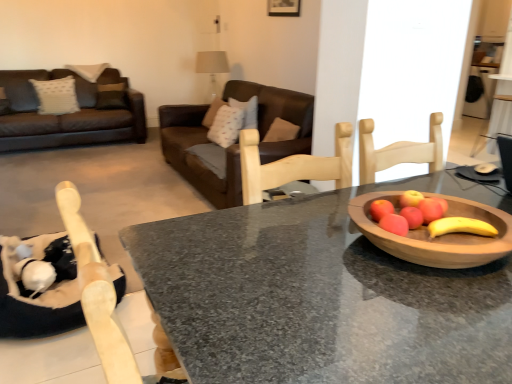
What is the approximate height of red matte apple at center?

The height of red matte apple at center is 4.58 centimeters.

I want to click on red matte apple at center, so click(412, 216).

Image resolution: width=512 pixels, height=384 pixels. Find the location of `red matte apple at center`. red matte apple at center is located at coordinates (412, 216).

Is granite table at center inside the boundaries of red matte apple at center, or outside?

The correct answer is: outside.

From the image's perspective, is granite table at center below red matte apple at center?

Yes, from the image's perspective, granite table at center is beneath red matte apple at center.

Can you confirm if granite table at center is positioned to the left of red matte apple at center?

In fact, granite table at center is to the right of red matte apple at center.

Where is `bowl below the red matte apple at center (from the image's perspective)`? The width and height of the screenshot is (512, 384). bowl below the red matte apple at center (from the image's perspective) is located at coordinates (440, 236).

Considering the sizes of objects red matte apple at center and wooden bowl at right in the image provided, who is taller, red matte apple at center or wooden bowl at right?

With more height is wooden bowl at right.

Which object is thinner, red matte apple at center or wooden bowl at right?

Thinner between the two is red matte apple at center.

Which is in front, point (412, 222) or point (396, 256)?

The point (396, 256) is closer.

Is red matte apple at center not within granite table at center?

Yes, red matte apple at center is outside of granite table at center.

Is red matte apple at center to the left or to the right of granite table at center in the image?

red matte apple at center is positioned on granite table at center's left side.

Considering the sizes of objects red matte apple at center and granite table at center in the image provided, who is thinner, red matte apple at center or granite table at center?

With smaller width is red matte apple at center.

Find the location of a particular element. This screenshot has height=384, width=512. desk located in front of the wooden bowl at right is located at coordinates (321, 296).

Relative to granite table at center, is wooden bowl at right in front or behind?

Visually, wooden bowl at right is located behind granite table at center.

Is wooden bowl at right smaller than granite table at center?

Correct, wooden bowl at right occupies less space than granite table at center.

Does wooden bowl at right appear on the left side of granite table at center?

Indeed, wooden bowl at right is positioned on the left side of granite table at center.

From the picture: Based on their sizes in the image, would you say granite table at center is bigger or smaller than wooden bowl at right?

Clearly, granite table at center is larger in size than wooden bowl at right.

Is wooden bowl at right a part of granite table at center?

No, wooden bowl at right is located outside of granite table at center.

Based on the photo, is granite table at center shorter than wooden bowl at right?

No.

In terms of width, does granite table at center look wider or thinner when compared to wooden bowl at right?

Considering their sizes, granite table at center looks broader than wooden bowl at right.

Based on their positions, is red matte apple at center located to the left or right of brown leather couch at center?

red matte apple at center is positioned on brown leather couch at center's right side.

Does red matte apple at center have a greater height compared to brown leather couch at center?

No, red matte apple at center is not taller than brown leather couch at center.

How many degrees apart are the facing directions of red matte apple at center and brown leather couch at center?

There is a 176-degree angle between the facing directions of red matte apple at center and brown leather couch at center.

Is wooden bowl at right not inside red matte apple at center?

Indeed, wooden bowl at right is completely outside red matte apple at center.

Locate an element on the screen. This screenshot has height=384, width=512. apple lying behind the wooden bowl at right is located at coordinates (412, 216).

Which object is further away from the camera taking this photo, wooden bowl at right or red matte apple at center?

red matte apple at center is more distant.

Is wooden bowl at right aimed at red matte apple at center?

No.

The image size is (512, 384). In the image, there is a red matte apple at center. What are the coordinates of `desk below it (from the image's perspective)` in the screenshot? It's located at (321, 296).

Where is `apple on the left of wooden bowl at right`? apple on the left of wooden bowl at right is located at coordinates (412, 216).

Looking at the image, which one is located further to brown leather couch at center, red matte apple at center or granite table at center?

Among the two, red matte apple at center is located further to brown leather couch at center.

Looking at the image, which one is located closer to wooden bowl at right, red matte apple at center or brown leather couch at center?

red matte apple at center is positioned closer to the anchor wooden bowl at right.

Consider the image. Estimate the real-world distances between objects in this image. Which object is closer to granite table at center, red matte apple at center or wooden bowl at right?

wooden bowl at right lies closer to granite table at center than the other object.

When comparing their distances from brown leather couch at center, does red matte apple at center or wooden bowl at right seem further?

red matte apple at center lies further to brown leather couch at center than the other object.

From the image, which object appears to be farther from brown leather couch at center, granite table at center or red matte apple at center?

The object further to brown leather couch at center is red matte apple at center.

From the image, which object appears to be nearer to brown leather couch at center, wooden bowl at right or red matte apple at center?

wooden bowl at right is positioned closer to the anchor brown leather couch at center.

Considering their positions, is brown leather couch at center positioned further to granite table at center than wooden bowl at right?

brown leather couch at center.

When comparing their distances from brown leather couch at center, does granite table at center or wooden bowl at right seem closer?

The object closer to brown leather couch at center is granite table at center.

The width and height of the screenshot is (512, 384). In order to click on apple positioned between granite table at center and brown leather couch at center from near to far in this screenshot , I will do `click(412, 216)`.

Find the location of `bowl between granite table at center and red matte apple at center in the front-back direction`. bowl between granite table at center and red matte apple at center in the front-back direction is located at coordinates (440, 236).

Find the location of a particular element. apple between wooden bowl at right and brown leather couch at center from front to back is located at coordinates (412, 216).

Locate an element on the screen. The height and width of the screenshot is (384, 512). bowl located between granite table at center and brown leather couch at center in the depth direction is located at coordinates (440, 236).